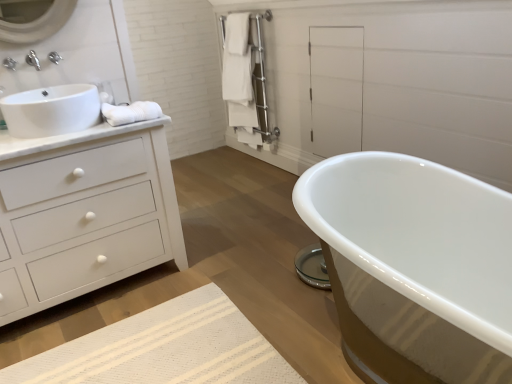
Image resolution: width=512 pixels, height=384 pixels. What are the coordinates of `vacant space to the right of white matte chest of drawers at left` in the screenshot? It's located at [225, 270].